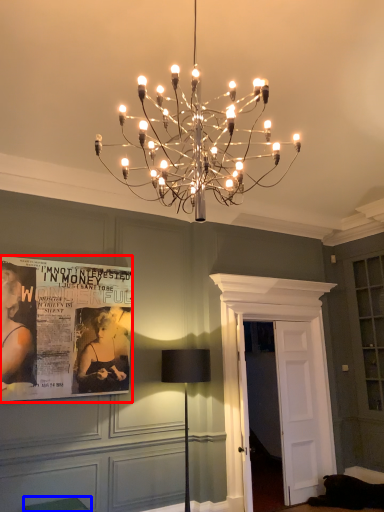
Question: Which object is further to the camera taking this photo, poster page (highlighted by a red box) or furniture (highlighted by a blue box)?

Choices:
 (A) poster page
 (B) furniture

Answer: (A)